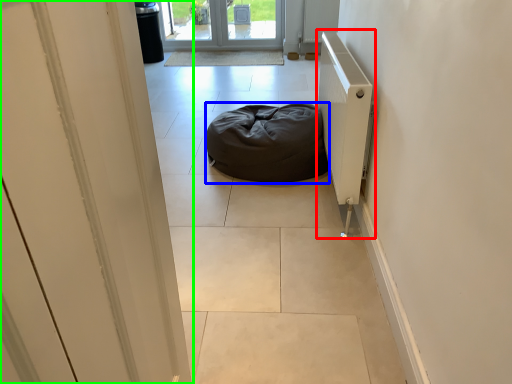
Question: Which object is the closest to the radiator (highlighted by a red box)? Choose among these: furniture (highlighted by a blue box) or door (highlighted by a green box).

Choices:
 (A) furniture
 (B) door

Answer: (A)